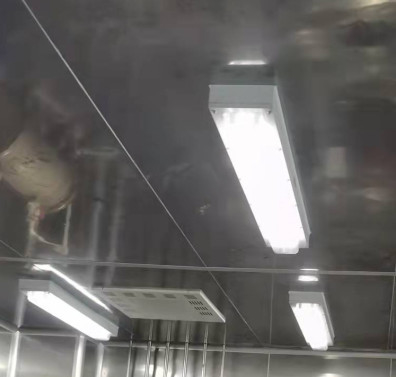
Where is `light housing`? The height and width of the screenshot is (377, 396). light housing is located at coordinates (75, 306), (322, 288), (270, 101).